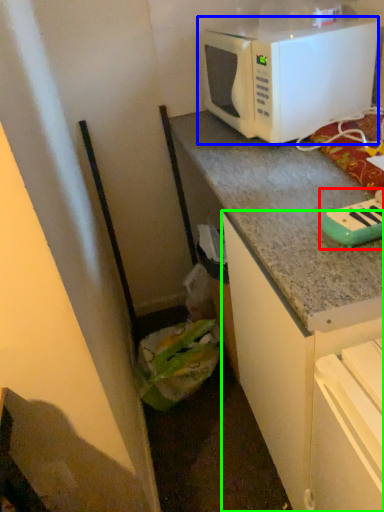
Question: Which object is the closest to the appliance (highlighted by a red box)? Choose among these: microwave oven (highlighted by a blue box) or cabinetry (highlighted by a green box).

Choices:
 (A) microwave oven
 (B) cabinetry

Answer: (B)